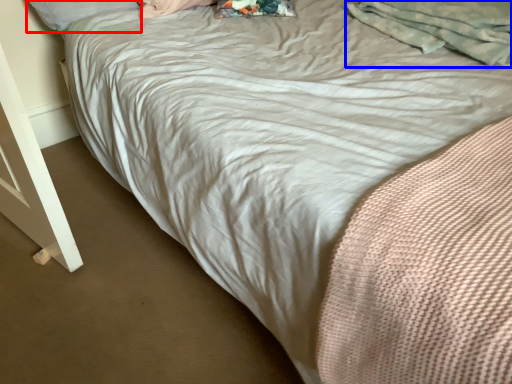
Question: Which point is closer to the camera, pillow (highlighted by a red box) or material (highlighted by a blue box)?

Choices:
 (A) pillow
 (B) material

Answer: (B)